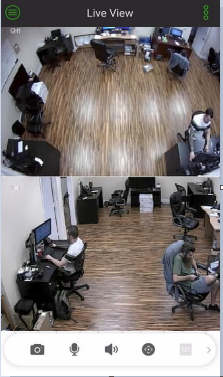
The width and height of the screenshot is (223, 377). Identify the location of floor. (121, 288).